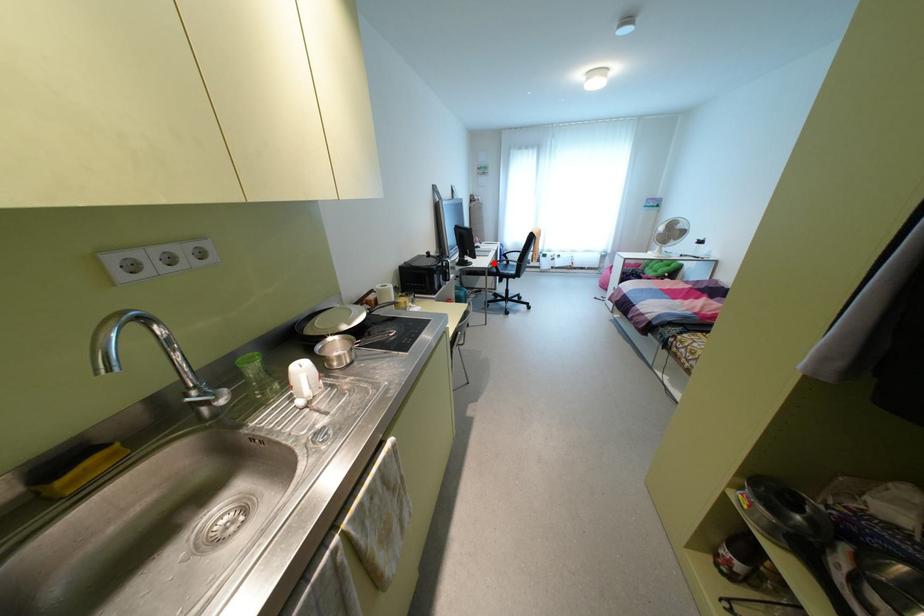
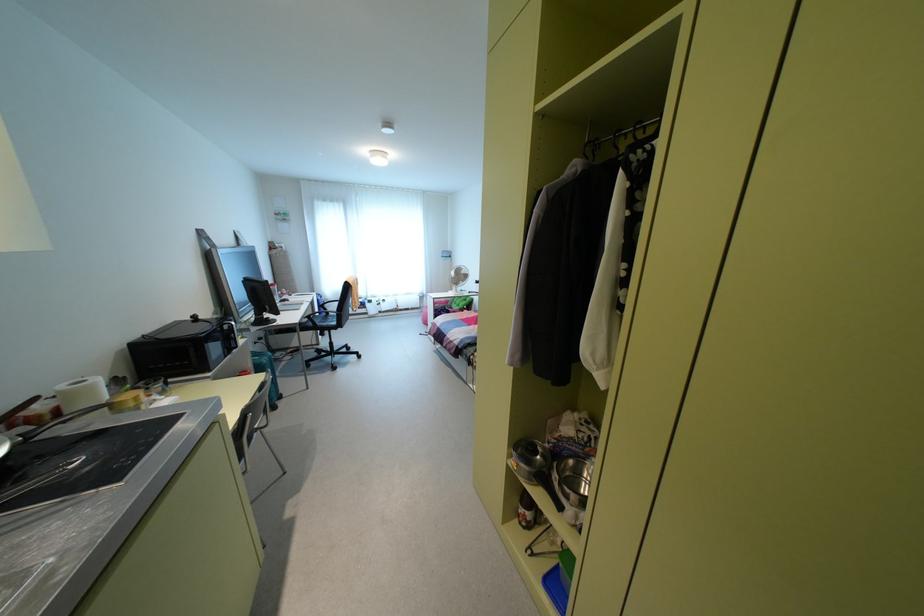
In the second image, find the point that corresponds to the highlighted location in the first image.

(309, 315)